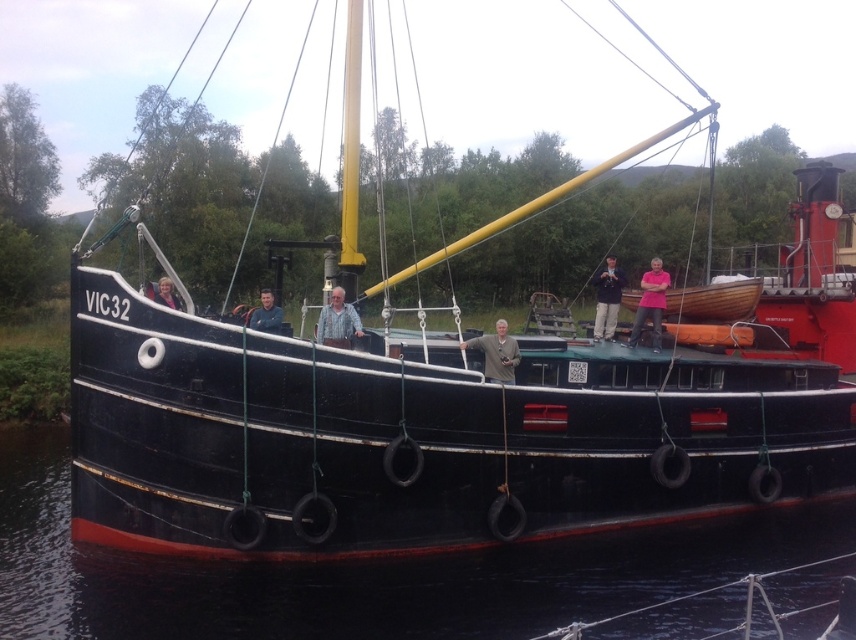
Question: Is dark blue shirt at center thinner than matte black shirt at center?

Choices:
 (A) yes
 (B) no

Answer: (A)

Question: Is dark blue shirt at center further to the viewer compared to matte black hair at upper center?

Choices:
 (A) yes
 (B) no

Answer: (A)

Question: Which of the following is the farthest from the observer?

Choices:
 (A) black rubber tires at lower center
 (B) light brown wooden pole at center
 (C) matte black shirt at center
 (D) dark blue shirt at center

Answer: (D)

Question: Which of the following is the farthest from the observer?

Choices:
 (A) (658, 257)
 (B) (159, 276)
 (C) (500, 320)

Answer: (A)

Question: Does light brown wooden pole at center appear under matte black shirt at center?

Choices:
 (A) no
 (B) yes

Answer: (B)

Question: Based on their relative distances, which object is nearer to the light brown wooden pole at center?

Choices:
 (A) black rubber tires at lower center
 (B) matte black shirt at center
 (C) pink fabric at center
 (D) dark blue shirt at center

Answer: (B)